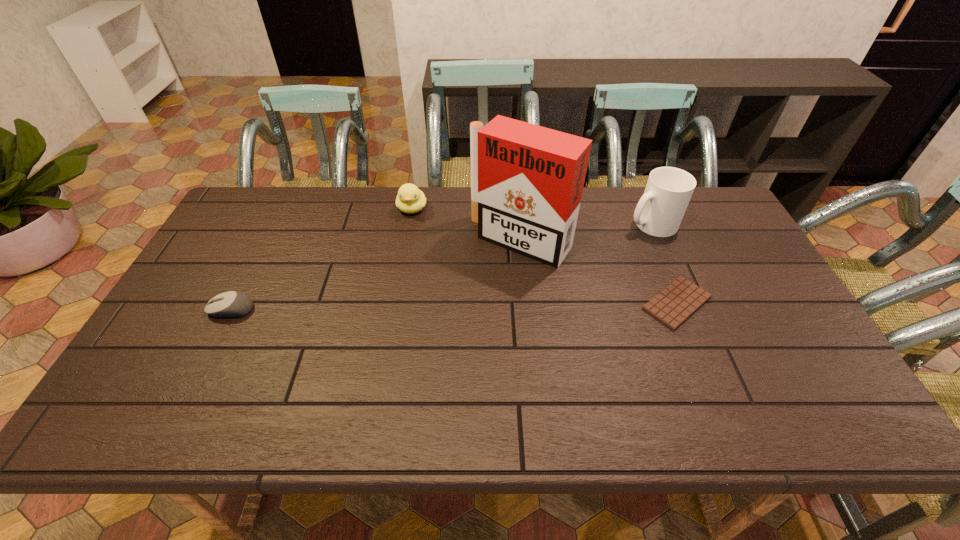
Locate an element on the screen. The height and width of the screenshot is (540, 960). vacant space situated on the front-facing side of the cigarette case is located at coordinates (422, 356).

Image resolution: width=960 pixels, height=540 pixels. I want to click on vacant region located on the front-facing side of the cigarette case, so (488, 275).

Find the location of a particular element. The width and height of the screenshot is (960, 540). vacant area situated 0.400m on the front-facing side of the cigarette case is located at coordinates (416, 365).

Image resolution: width=960 pixels, height=540 pixels. In order to click on free location located 0.200m at the beak of the fourth object from right to left in this screenshot , I will do (404, 262).

In order to click on vacant area located 0.210m at the beak of the fourth object from right to left in this screenshot , I will do `click(403, 264)`.

Where is `blank area located at the beak of the fourth object from right to left`? blank area located at the beak of the fourth object from right to left is located at coordinates (400, 289).

This screenshot has width=960, height=540. Identify the location of free region located 0.230m on the handle side of the mug. pos(584,262).

Locate an element on the screen. Image resolution: width=960 pixels, height=540 pixels. vacant space located on the handle side of the mug is located at coordinates click(579, 265).

You are a GUI agent. You are given a task and a screenshot of the screen. Output one action in this format:
    pyautogui.click(x=<x>, y=<y>)
    Task: Click on the free spot located on the handle side of the mug
    
    Given the screenshot: What is the action you would take?
    pyautogui.click(x=586, y=261)

You are a GUI agent. You are given a task and a screenshot of the screen. Output one action in this format:
    pyautogui.click(x=<x>, y=<y>)
    Task: Click on the cigarette case located in the far edge section of the desktop
    The height and width of the screenshot is (540, 960).
    Given the screenshot: What is the action you would take?
    pyautogui.click(x=527, y=181)